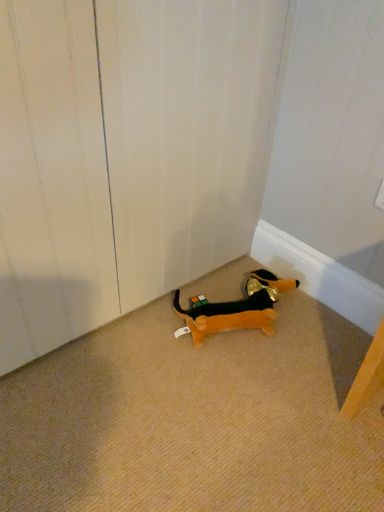
Locate an element on the screen. The width and height of the screenshot is (384, 512). velvet orange dog at lower center is located at coordinates (235, 308).

From the picture: Measure the distance between velvet orange dog at lower center and camera.

velvet orange dog at lower center is 3.97 feet from camera.

Image resolution: width=384 pixels, height=512 pixels. Describe the element at coordinates (235, 308) in the screenshot. I see `velvet orange dog at lower center` at that location.

This screenshot has width=384, height=512. I want to click on velvet orange dog at lower center, so click(x=235, y=308).